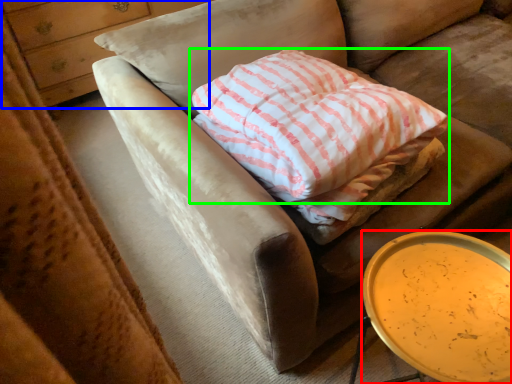
Question: Considering the real-world distances, which object is farthest from table (highlighted by a red box)? dresser (highlighted by a blue box) or pillow (highlighted by a green box)?

Choices:
 (A) dresser
 (B) pillow

Answer: (A)